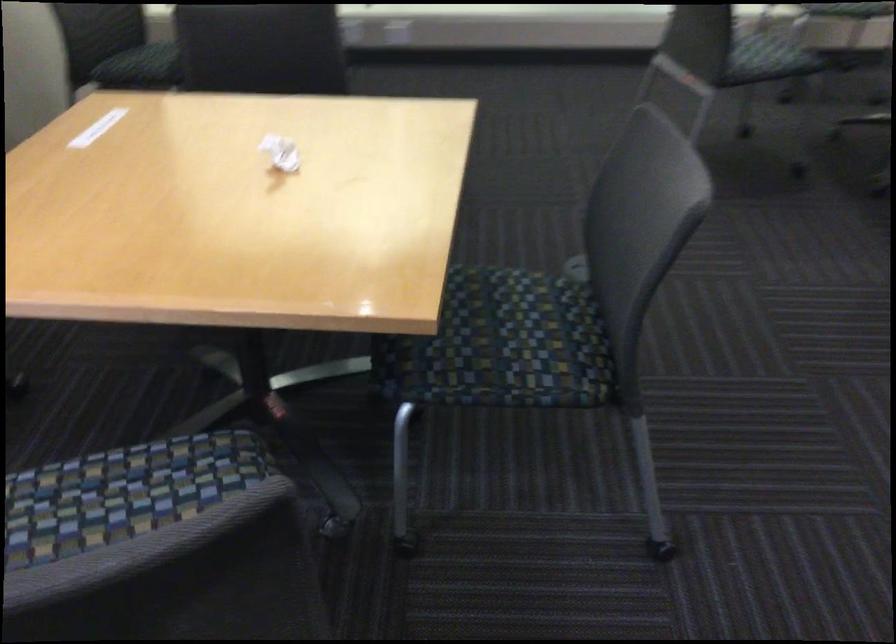
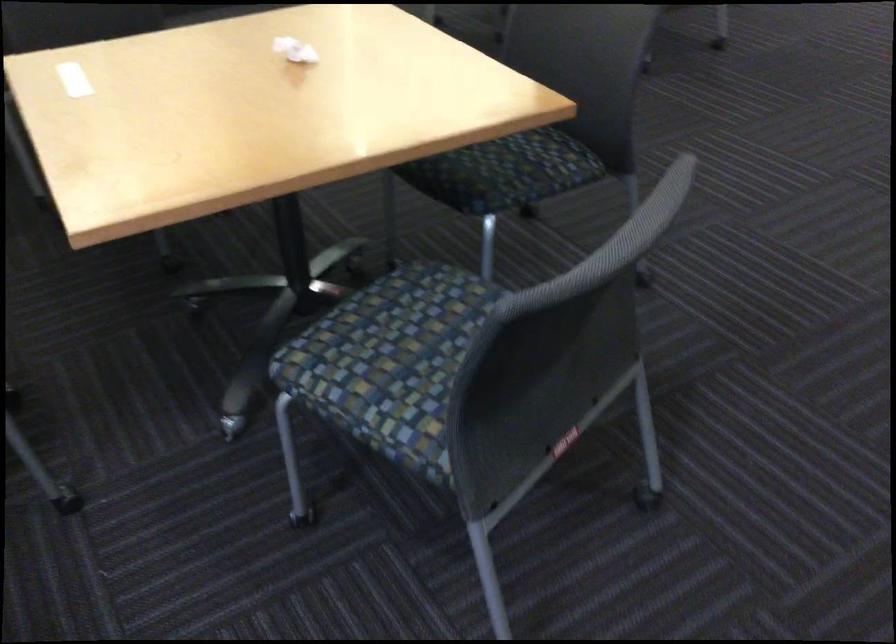
The point at (287, 154) is marked in the first image. Where is the corresponding point in the second image?

(295, 50)